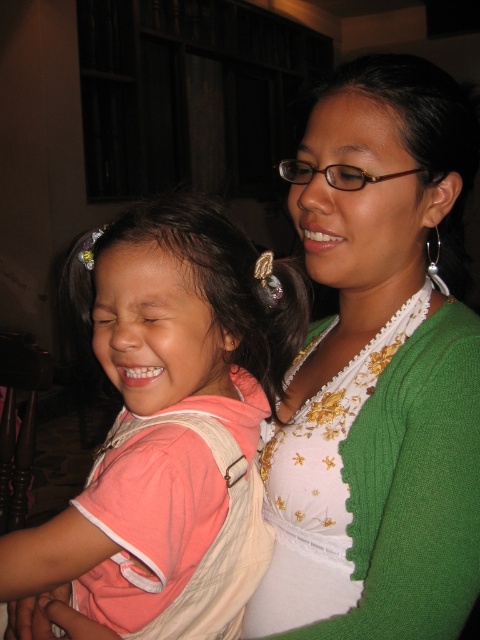
You are helping to organize a clothing donation drive. You have two items to place in boxes labeled for adult and children sizes. The green textured sweater at upper right and the pink fabric shirt at left are both in good condition. Based on their sizes, which box should each item go into?

The green textured sweater at upper right is larger and should go into the adult box, while the pink fabric shirt at left is smaller and should be placed in the children box.

You are standing at the center of the room and see two points marked in the image. Which point is closer to you, point (382, 464) or point (187, 323)?

Point (187, 323) is closer to you because it is in front of point (382, 464).

You are a tailor who needs to determine if the green textured sweater at upper right can be folded and stored in the same space as the pink fabric shirt at left. Based on their sizes, will the sweater fit in the shirt storage space?

The green textured sweater at upper right might be wider than the pink fabric shirt at left, so it may not fit in the shirt storage space unless the space is adjusted or the sweater is folded more carefully.